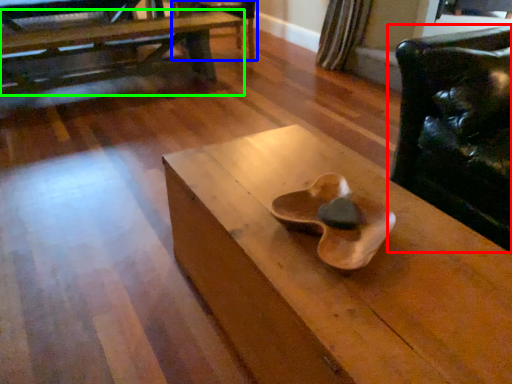
Question: Which is nearer to the chair (highlighted by a red box)? armchair (highlighted by a blue box) or table (highlighted by a green box).

Choices:
 (A) armchair
 (B) table

Answer: (A)